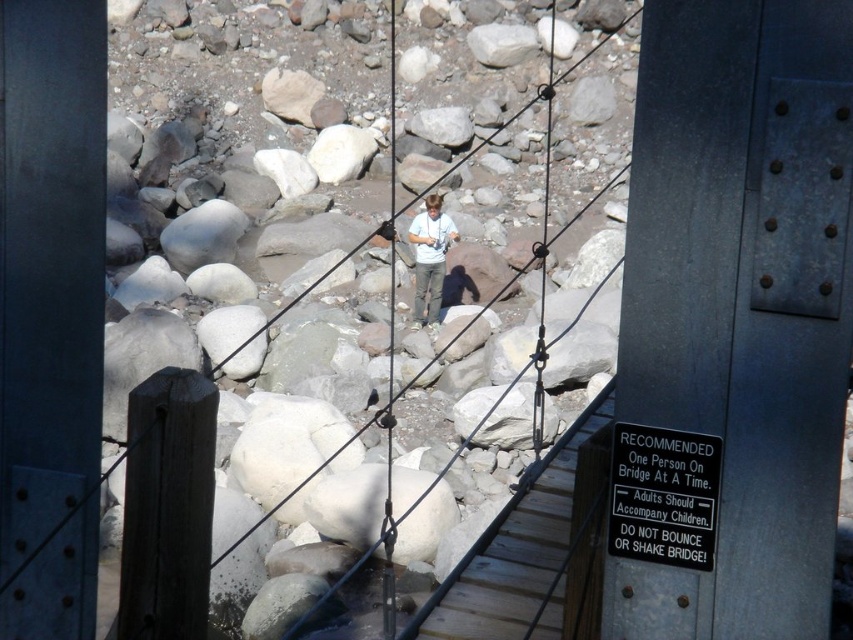
You are standing on the suspension bridge and want to place a small potted plant exactly where the wooden at center is located. According to the image, what are the coordinates where you should place the plant?

The wooden at center is located at coordinates point (567, 68), so you should place the potted plant there.

You are standing on the suspension bridge and notice a specific point marked at coordinates (567, 68). Based on the scene description, what material is located at that point?

The point at coordinates (567, 68) corresponds to the wooden planks forming the walkway of the suspension bridge.

You are standing on the suspension bridge and notice two items at the center of the bridge. Which one is more to the left side? The wooden at center or the light blue shirt at center?

The wooden at center is positioned on the left side of light blue shirt at center, so the wooden at center is more to the left side.